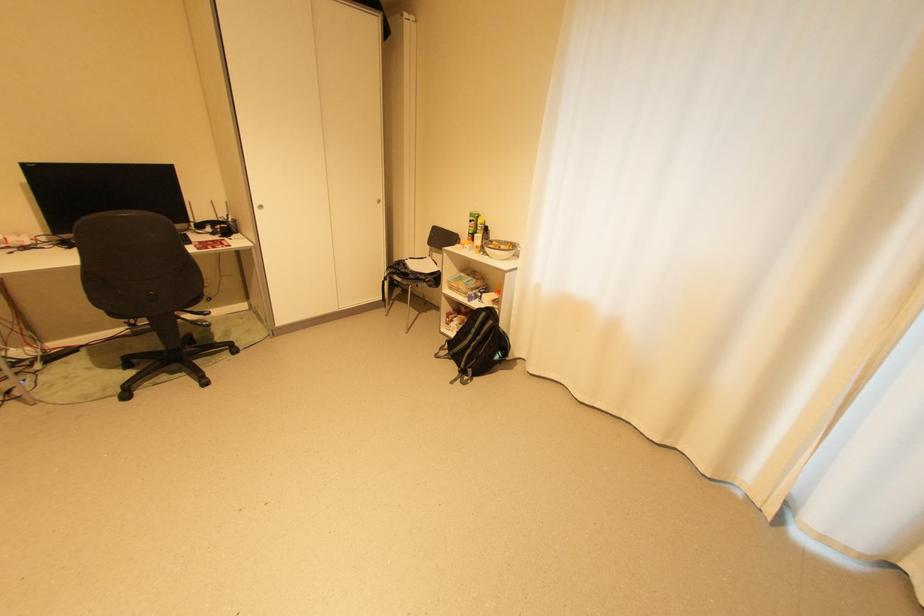
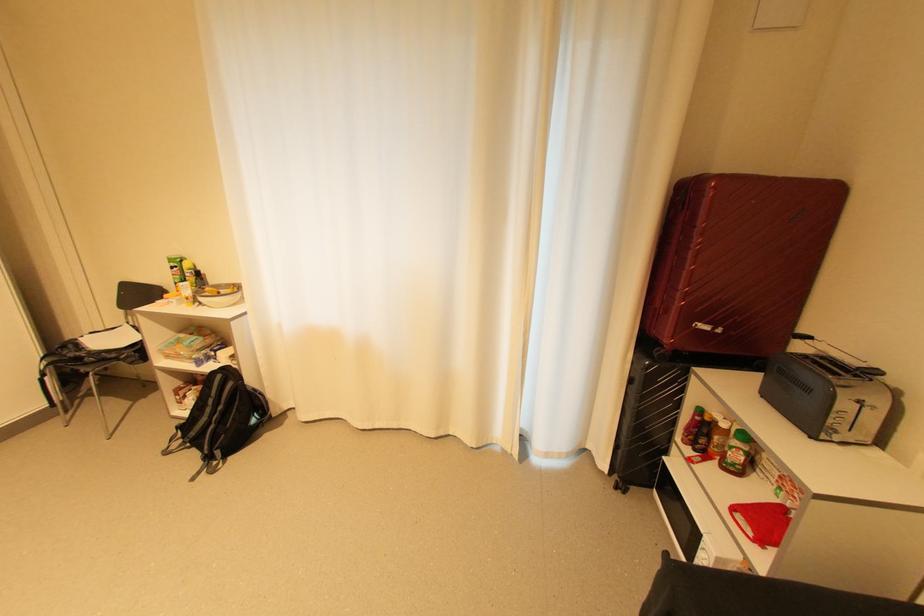
Find the pixel in the second image that matches point 408,264 in the first image.

(79, 346)